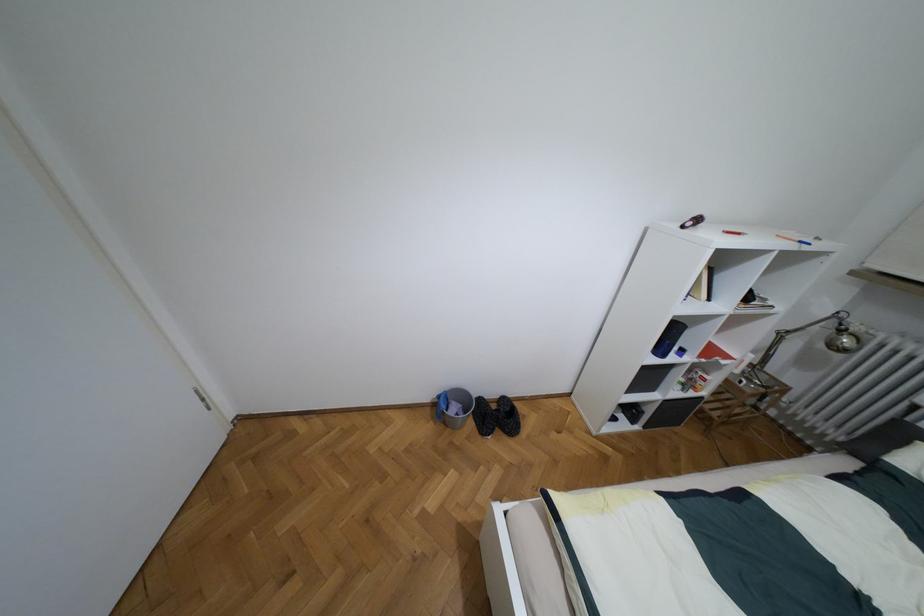
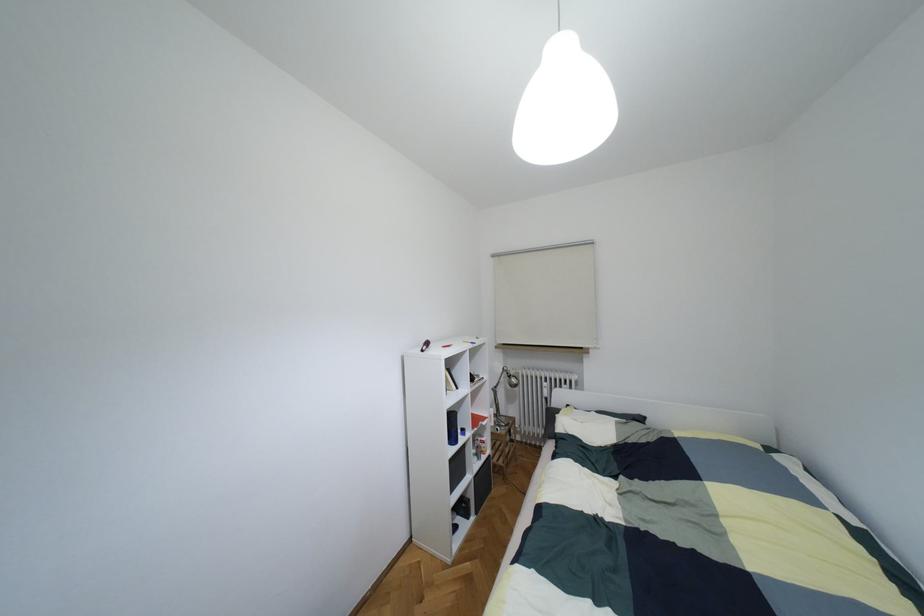
Question: I am providing you with two images of the same scene from different viewpoints. After the viewpoint changes to image2, which objects are now occluded?

Choices:
 (A) silver lamp head
 (B) black speaker
 (C) stool sitting surface
 (D) none of these

Answer: (D)